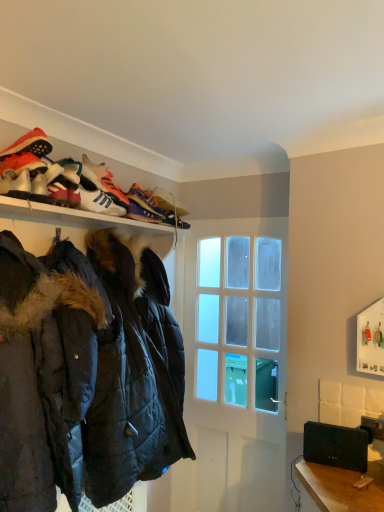
Locate an element on the screen. empty space that is ontop of clear glass door at center is located at coordinates (244, 223).